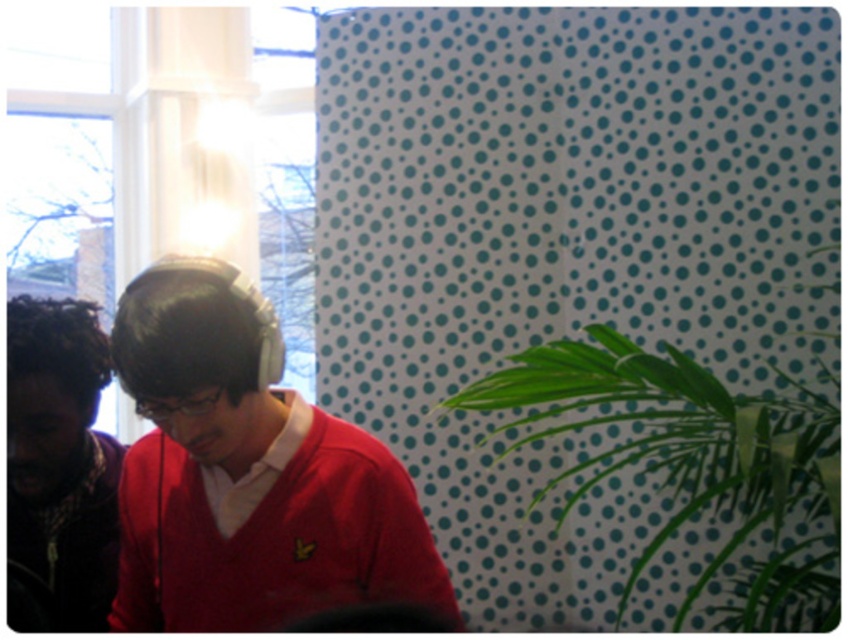
Question: Which object is closer to the camera taking this photo?

Choices:
 (A) matte red sweater at center
 (B) dark brown curly hair at left

Answer: (A)

Question: From the image, what is the correct spatial relationship of matte red sweater at center in relation to dark brown curly hair at left?

Choices:
 (A) above
 (B) below

Answer: (A)

Question: Does matte red sweater at center come behind green leafy plant at right?

Choices:
 (A) no
 (B) yes

Answer: (A)

Question: Which point is farther to the camera?

Choices:
 (A) (650, 548)
 (B) (93, 554)

Answer: (A)

Question: Which of the following is the farthest from the observer?

Choices:
 (A) (676, 417)
 (B) (335, 502)

Answer: (A)

Question: From the image, what is the correct spatial relationship of matte red sweater at center in relation to green leafy plant at right?

Choices:
 (A) right
 (B) left

Answer: (B)